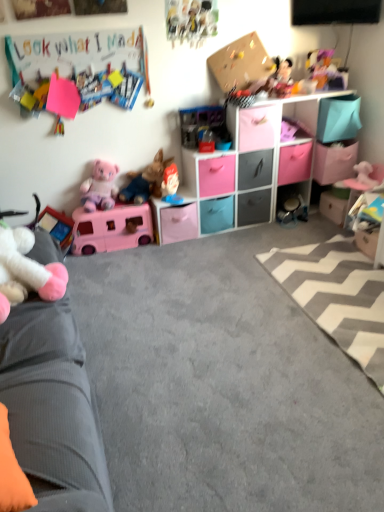
You are a GUI agent. You are given a task and a screenshot of the screen. Output one action in this format:
    pyautogui.click(x=<x>, y=<y>)
    Task: Click on the vacant space in front of matte plastic storage unit at upper center
    Image resolution: width=384 pixels, height=512 pixels.
    Given the screenshot: What is the action you would take?
    pyautogui.click(x=222, y=282)